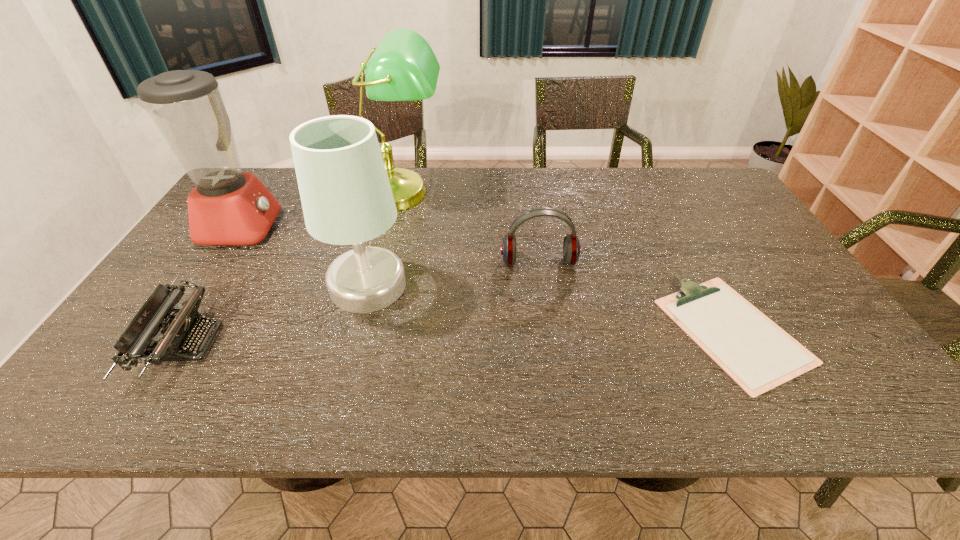
At what (x,y) coordinates should I click in order to perform the action: click on object that is at the right edge. Please return your answer as a coordinate pair (x, y). Looking at the image, I should click on (756, 353).

Locate an element on the screen. The image size is (960, 540). object present at the far left corner is located at coordinates (227, 207).

Find the location of a particular element. The image size is (960, 540). object that is at the near left corner is located at coordinates (178, 332).

Locate an element on the screen. The width and height of the screenshot is (960, 540). object at the near right corner is located at coordinates (756, 353).

Locate an element on the screen. vacant space at the far edge of the desktop is located at coordinates (507, 170).

The width and height of the screenshot is (960, 540). I want to click on free location at the near edge, so click(x=301, y=414).

This screenshot has height=540, width=960. Identify the location of free space at the far left corner of the desktop. (280, 183).

In the image, there is a desktop. In order to click on free space at the far right corner in this screenshot , I will do `click(683, 190)`.

Identify the location of free spot between the shortest object and the blender. (488, 279).

Find the location of `vacant point located between the shortest object and the blender`. vacant point located between the shortest object and the blender is located at coordinates (488, 279).